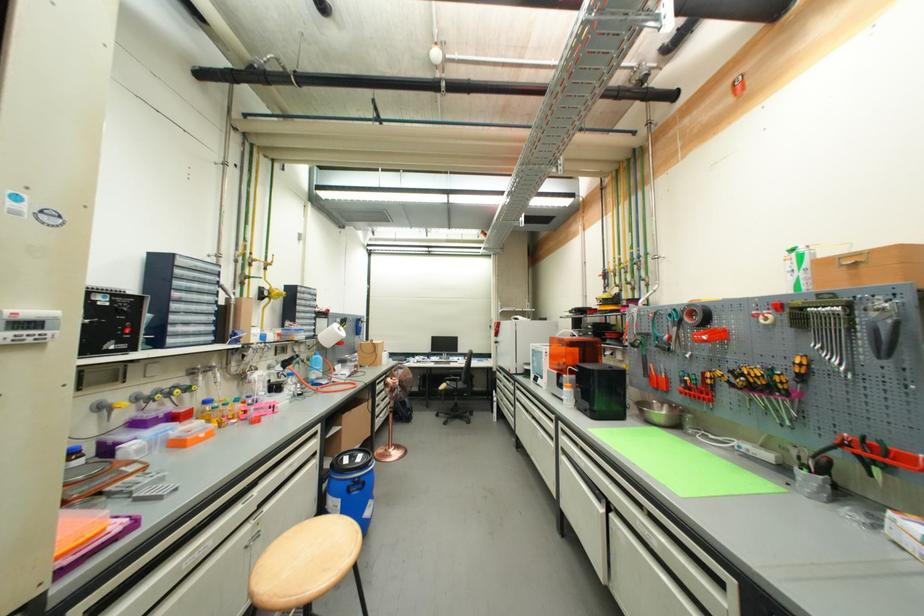
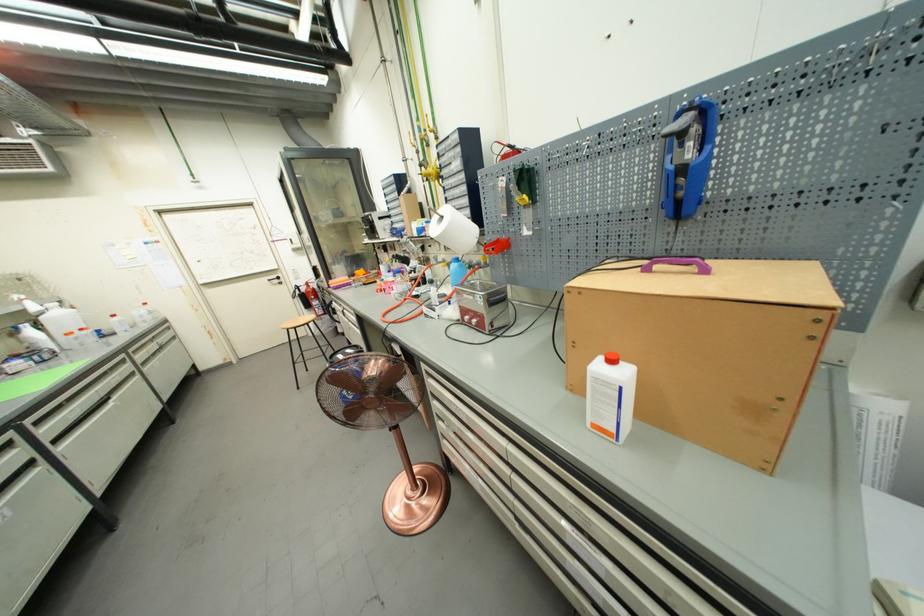
In the second image, find the point that corresponds to the point at 391,353 in the first image.

(617, 363)